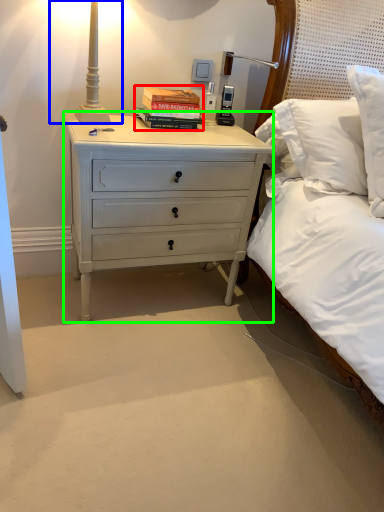
Question: Estimate the real-world distances between objects in this image. Which object is closer to book (highlighted by a red box), bedside lamp (highlighted by a blue box) or nightstand (highlighted by a green box)?

Choices:
 (A) bedside lamp
 (B) nightstand

Answer: (A)